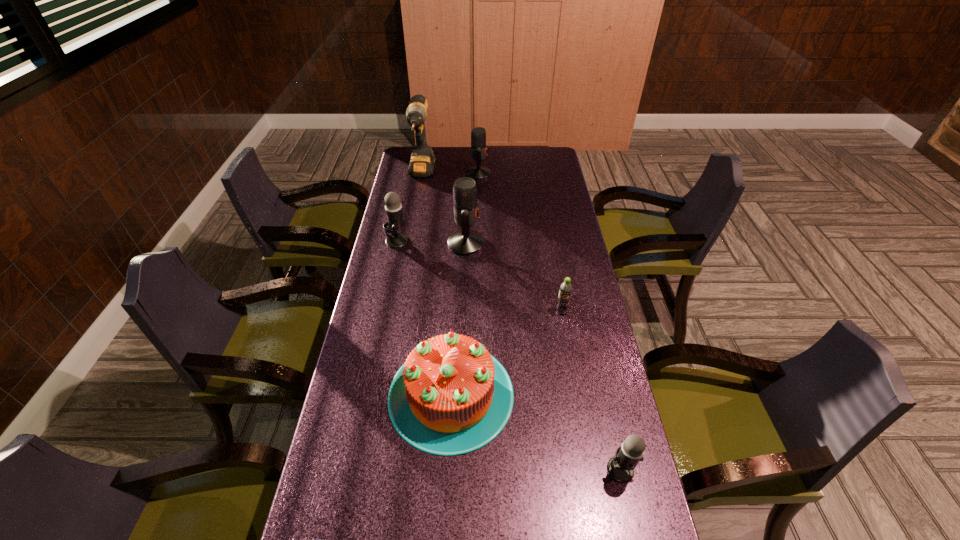
Identify which microphone is the second nearest to the tallest object. Please provide its 2D coordinates. Your answer should be formatted as a tuple, i.e. [(x, y)], where the tuple contains the x and y coordinates of a point satisfying the conditions above.

[(395, 221)]

Image resolution: width=960 pixels, height=540 pixels. Identify the location of microphone that stands as the third closest to the right gray microphone. (478, 134).

This screenshot has width=960, height=540. What are the coordinates of `the closest red microphone to the drill` in the screenshot? It's located at (478, 134).